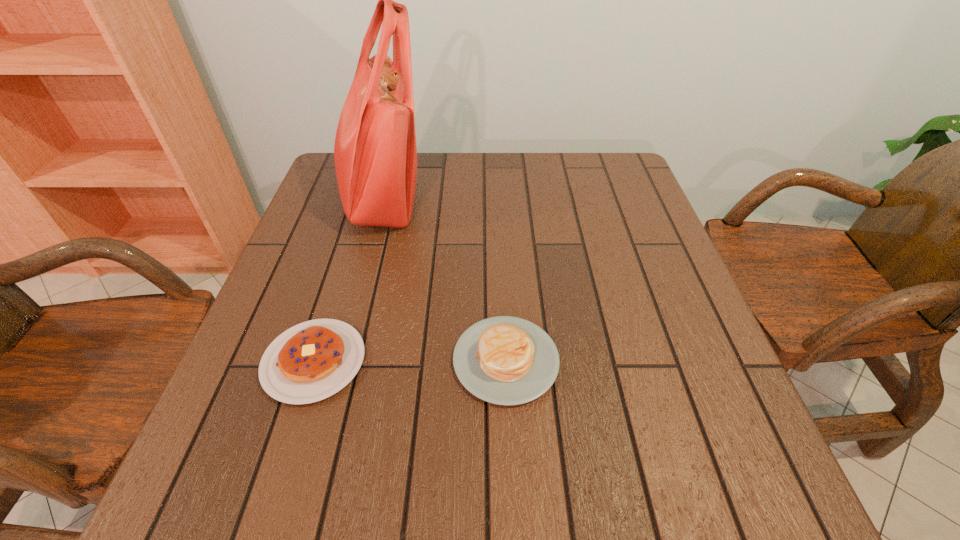
Find the location of a particular element. The width and height of the screenshot is (960, 540). vacant area that lies between the right pancake and the shortest object is located at coordinates (410, 361).

This screenshot has width=960, height=540. I want to click on free spot between the left pancake and the handbag, so click(x=348, y=279).

Identify the location of free point between the left pancake and the handbag. (348, 279).

This screenshot has height=540, width=960. In order to click on free spot between the second shortest object and the shorter pancake in this screenshot , I will do `click(410, 361)`.

At what (x,y) coordinates should I click in order to perform the action: click on vacant space in between the shortest object and the handbag. Please return your answer as a coordinate pair (x, y). This screenshot has width=960, height=540. Looking at the image, I should click on (348, 279).

This screenshot has width=960, height=540. I want to click on vacant space in between the second shortest object and the tallest object, so click(x=444, y=279).

Find the location of a particular element. The width and height of the screenshot is (960, 540). vacant area between the left pancake and the tallest object is located at coordinates (348, 279).

Locate which object is the second closest to the shorter pancake. Please provide its 2D coordinates. Your answer should be formatted as a tuple, i.e. [(x, y)], where the tuple contains the x and y coordinates of a point satisfying the conditions above.

[(375, 152)]

Locate an element on the screen. The width and height of the screenshot is (960, 540). object that ranks as the second closest to the taller pancake is located at coordinates (375, 152).

At what (x,y) coordinates should I click in order to perform the action: click on vacant space that satisfies the following two spatial constraints: 1. on the front-facing side of the taller pancake; 2. on the left side of the handbag. Please return your answer as a coordinate pair (x, y). The width and height of the screenshot is (960, 540). Looking at the image, I should click on (336, 360).